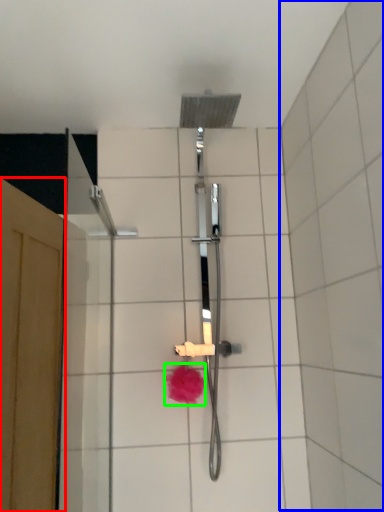
Question: Estimate the real-world distances between objects in this image. Which object is farther from screen door (highlighted by a red box), ceramic tile (highlighted by a blue box) or flower (highlighted by a green box)?

Choices:
 (A) ceramic tile
 (B) flower

Answer: (A)